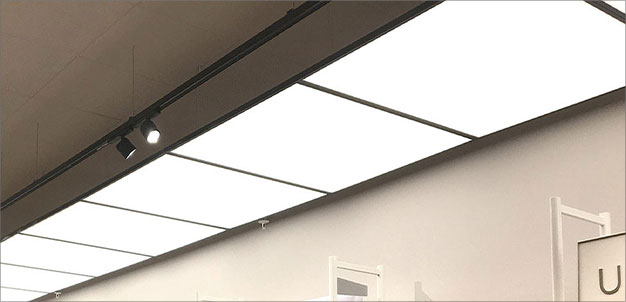
Find the location of a particular element. The width and height of the screenshot is (626, 302). light panels is located at coordinates (466, 47), (329, 146), (183, 181), (126, 218), (57, 255), (23, 282), (11, 298).